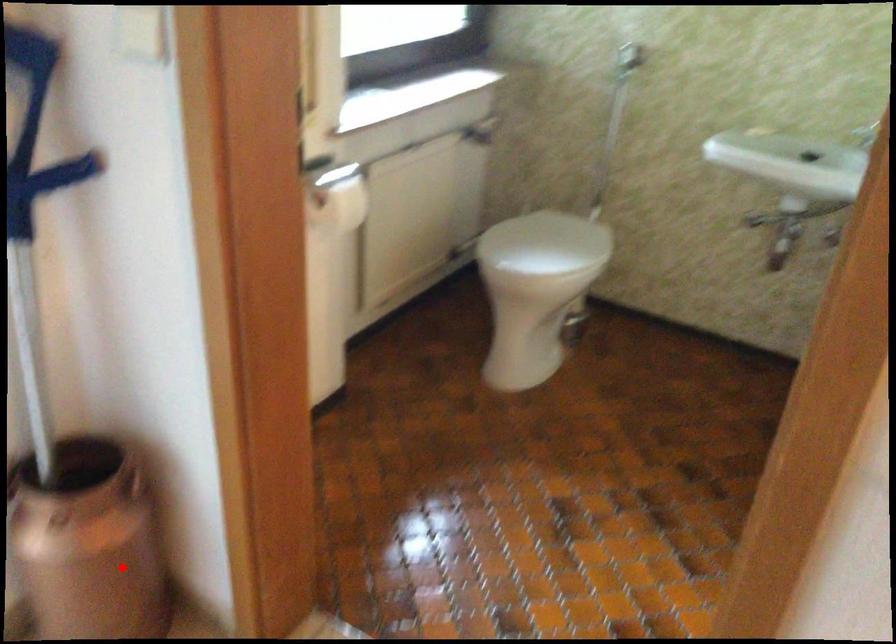
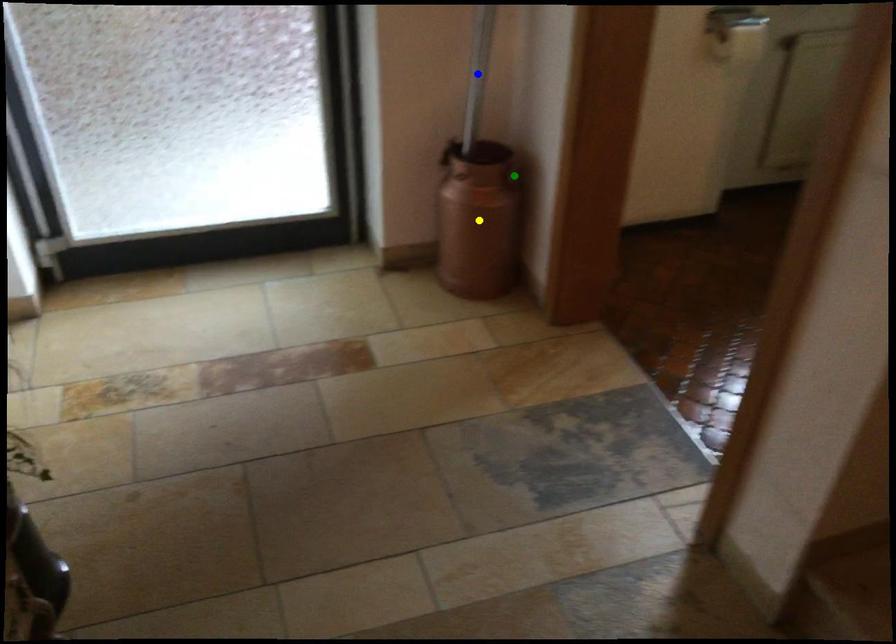
Question: I am providing you with two images of the same scene from different viewpoints. A red point is marked on the first image. You are given multiple points on the second image. Which point in image 2 is actually the same real-world point as the red point in image 1?

Choices:
 (A) blue point
 (B) green point
 (C) yellow point

Answer: (C)